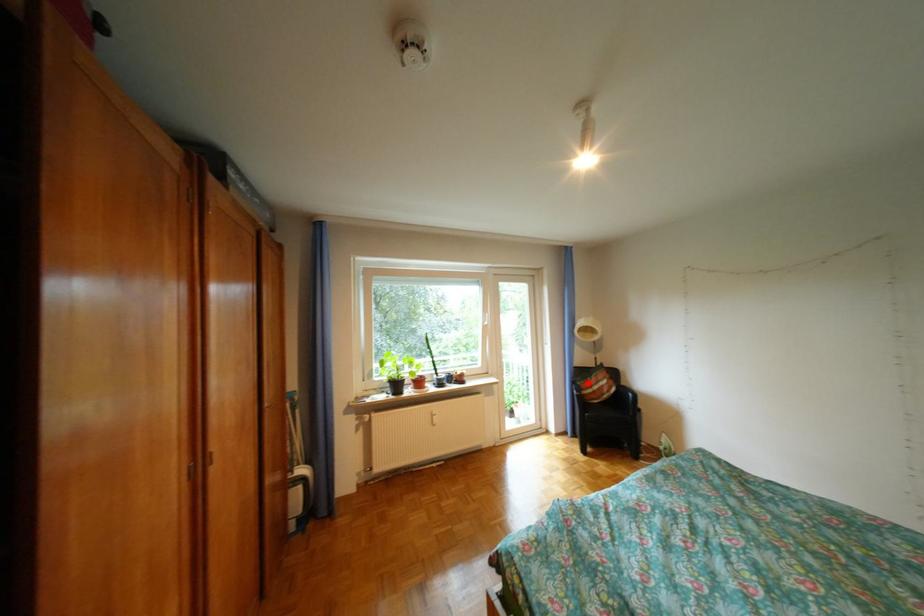
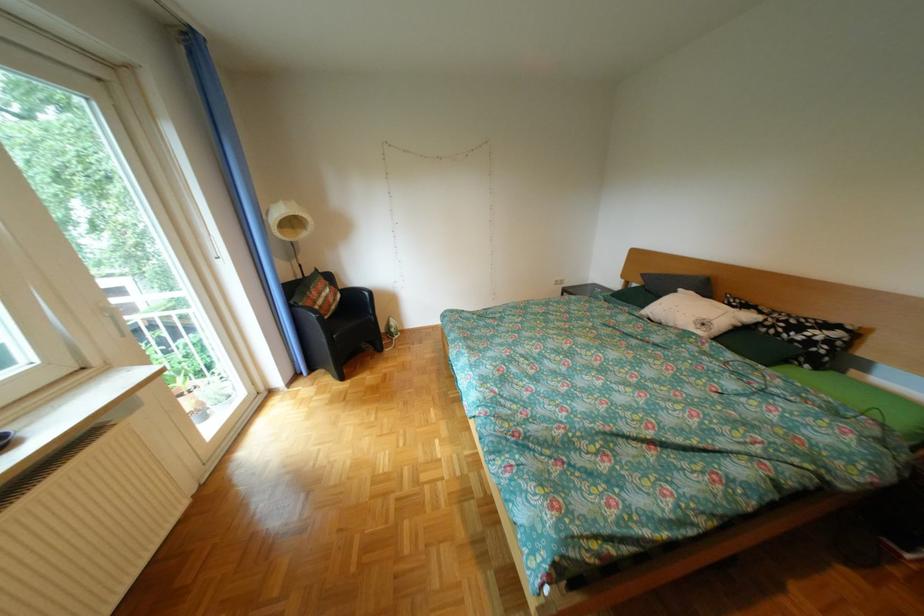
Question: I am providing you with two images of the same scene from different viewpoints. Given a red point in image1, look at the same physical point in image2. Is it:

Choices:
 (A) Closer to the viewpoint
 (B) Farther from the viewpoint

Answer: (A)